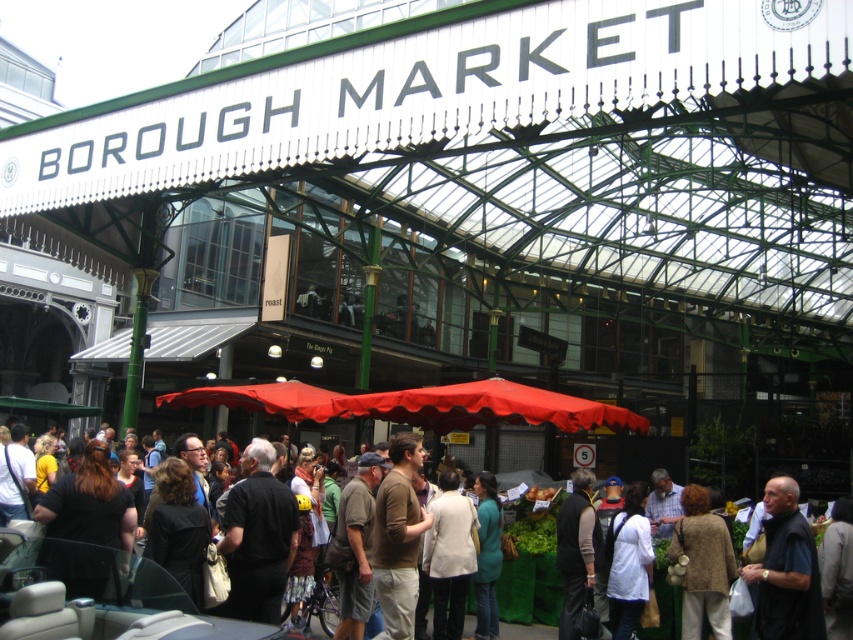
Who is more distant from viewer, (204, 632) or (785, 586)?

Positioned behind is point (785, 586).

Which is in front, point (178, 595) or point (782, 612)?

Point (178, 595)

Does point (177, 595) come behind point (786, 605)?

No, (177, 595) is in front of (786, 605).

Identify the location of white cotton shirt at center. The width and height of the screenshot is (853, 640). (100, 596).

Between white cotton shirt at center and black matte shirt at center, which one has less height?

white cotton shirt at center is shorter.

Does point (28, 611) lie behind point (247, 548)?

That is False.

Image resolution: width=853 pixels, height=640 pixels. In order to click on white cotton shirt at center in this screenshot , I will do `click(100, 596)`.

Which is below, white cotton shirt at center or brown cotton shirt at center?

Positioned lower is brown cotton shirt at center.

Who is shorter, white cotton shirt at center or brown cotton shirt at center?

white cotton shirt at center is shorter.

Where is `white cotton shirt at center`? white cotton shirt at center is located at coordinates (100, 596).